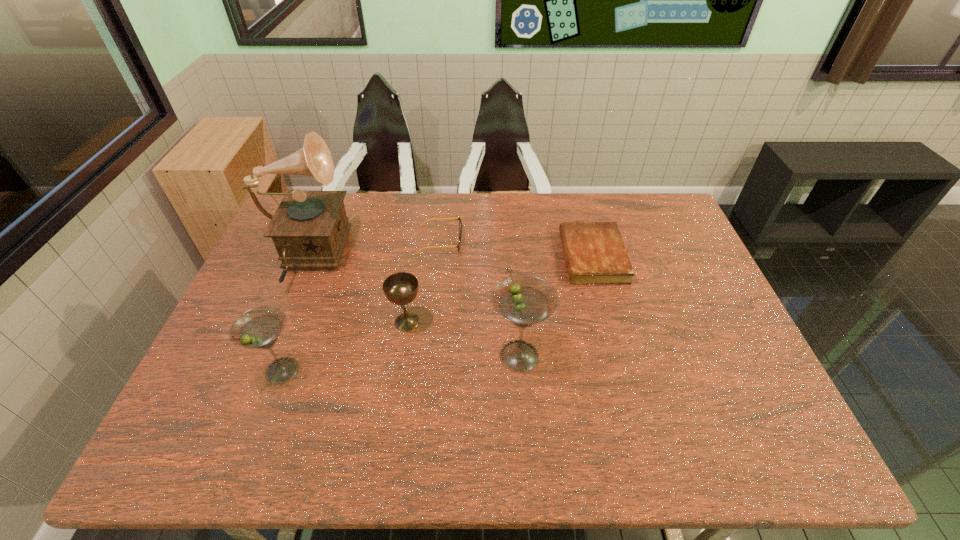
Find the location of `record player that is positioned at the left edge`. record player that is positioned at the left edge is located at coordinates (309, 229).

The image size is (960, 540). In order to click on object that is at the far left corner in this screenshot , I will do `click(309, 229)`.

Find the location of a particular element. object that is at the near left corner is located at coordinates (258, 328).

Find the location of a particular element. free location at the far edge is located at coordinates (561, 193).

The height and width of the screenshot is (540, 960). In the image, there is a desktop. Find the location of `vacant space at the right edge`. vacant space at the right edge is located at coordinates (681, 312).

I want to click on free spot at the near left corner of the desktop, so click(x=242, y=393).

Locate an element on the screen. vacant space at the near right corner is located at coordinates (734, 386).

At what (x,y) coordinates should I click in order to perform the action: click on vacant point located between the spectacles and the chalice. Please return your answer as a coordinate pair (x, y). This screenshot has height=540, width=960. Looking at the image, I should click on (423, 281).

You are a GUI agent. You are given a task and a screenshot of the screen. Output one action in this format:
    pyautogui.click(x=<x>, y=<y>)
    Task: Click on the vacant space in between the left martini and the spectacles
    The image size is (960, 540).
    Given the screenshot: What is the action you would take?
    pyautogui.click(x=361, y=305)

Where is `free space between the second object from right to left and the spectacles`? The height and width of the screenshot is (540, 960). free space between the second object from right to left and the spectacles is located at coordinates (480, 298).